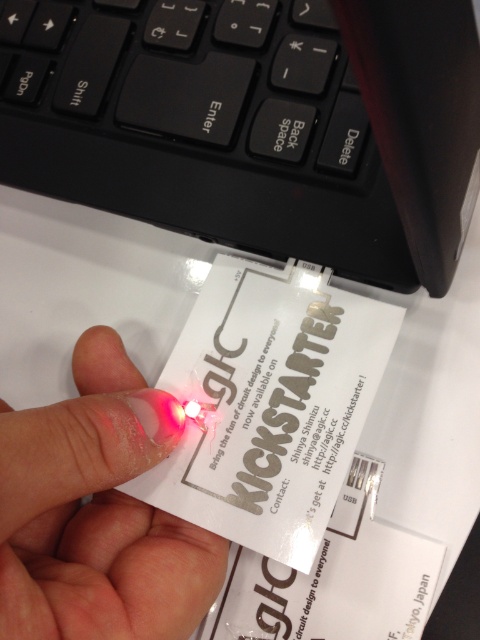
You are a graphic designer working on a project. You need to place a sticker on the white paper at center so it can be seen even when the black matte keyboard at upper center is in place. Where should you position the sticker?

The white paper at center is behind the black matte keyboard at upper center, so to ensure visibility, the sticker should be placed on the part of the white paper that is not covered by the keyboard.

You are setting up a presentation and need to place both the black matte keyboard at upper center and the white paper at center on a table. Which object should you place closer to the edge of the table to ensure both fit without overlapping?

The black matte keyboard at upper center is shorter than the white paper at center, so you should place the black matte keyboard at upper center closer to the edge of the table to ensure both fit without overlapping.

What are the coordinates of the white paper at center?

The white paper at center is located at point (269, 404).